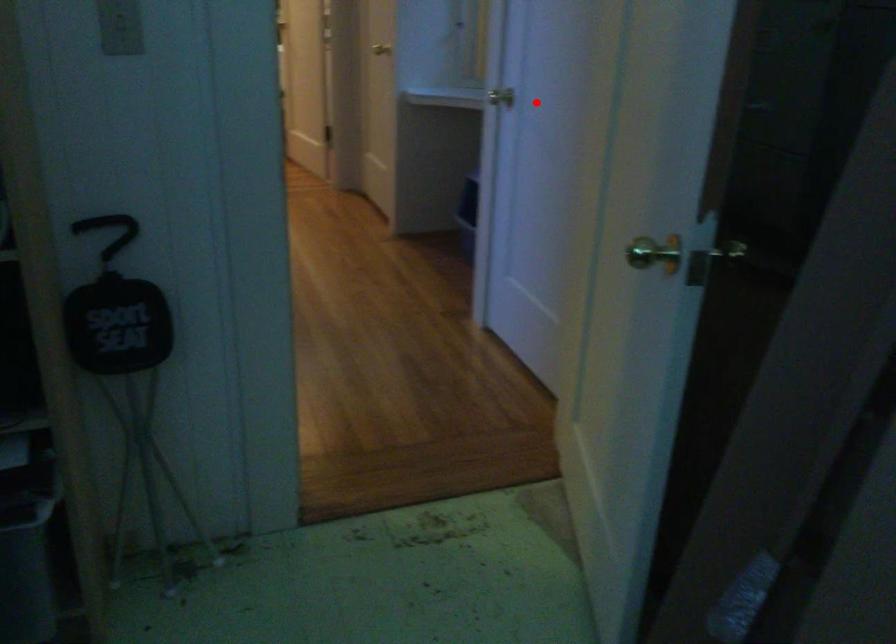
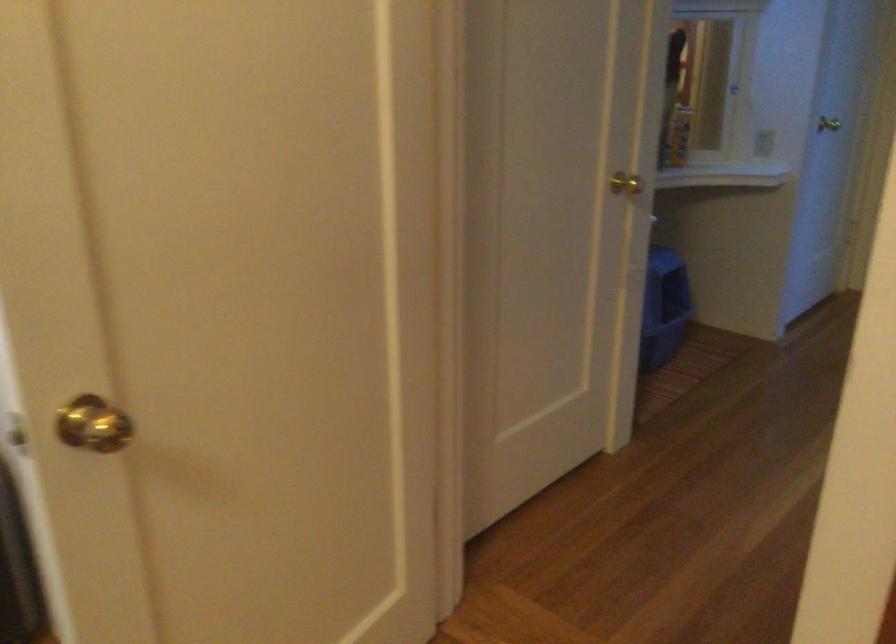
The point at the highlighted location is marked in the first image. Where is the corresponding point in the second image?

(762, 143)